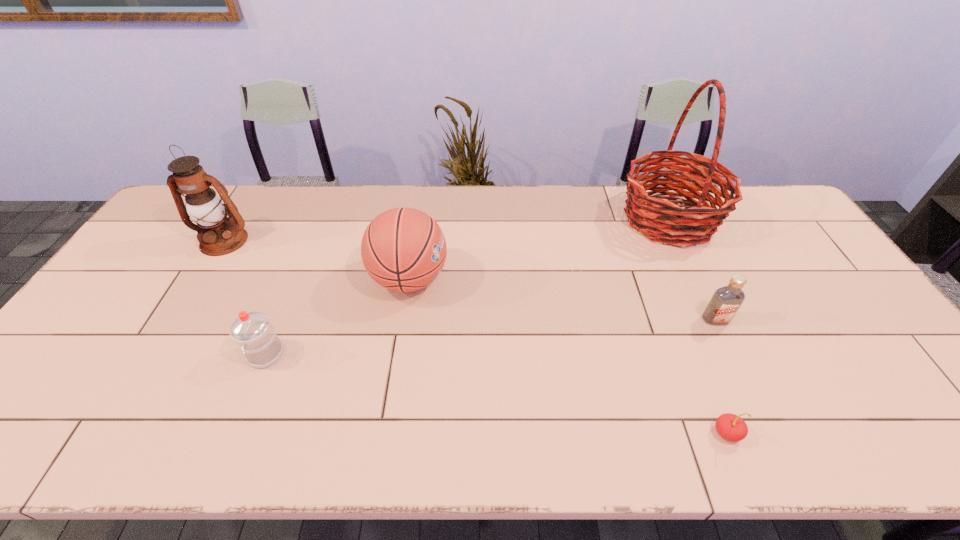
Locate an element on the screen. object situated at the near edge is located at coordinates (730, 427).

At what (x,y) coordinates should I click in order to perform the action: click on object that is at the left edge. Please return your answer as a coordinate pair (x, y). Image resolution: width=960 pixels, height=540 pixels. Looking at the image, I should click on (218, 235).

Where is `object located at the far left corner`? Image resolution: width=960 pixels, height=540 pixels. object located at the far left corner is located at coordinates (218, 235).

The height and width of the screenshot is (540, 960). I want to click on vacant space at the far edge, so click(x=426, y=201).

Locate an element on the screen. The image size is (960, 540). vacant region at the near edge of the desktop is located at coordinates (x=698, y=447).

The width and height of the screenshot is (960, 540). In the image, there is a desktop. Find the location of `vacant area at the left edge`. vacant area at the left edge is located at coordinates (131, 274).

Identify the location of vacant space at the right edge of the desktop. This screenshot has width=960, height=540. (783, 265).

Locate an element on the screen. The image size is (960, 540). vacant point located between the tallest object and the second object from left to right is located at coordinates (468, 287).

Where is `empty space that is in between the leftmost object and the basket`? This screenshot has height=540, width=960. empty space that is in between the leftmost object and the basket is located at coordinates (446, 230).

Locate an element on the screen. Image resolution: width=960 pixels, height=540 pixels. unoccupied position between the fourth shortest object and the water bottle is located at coordinates (338, 316).